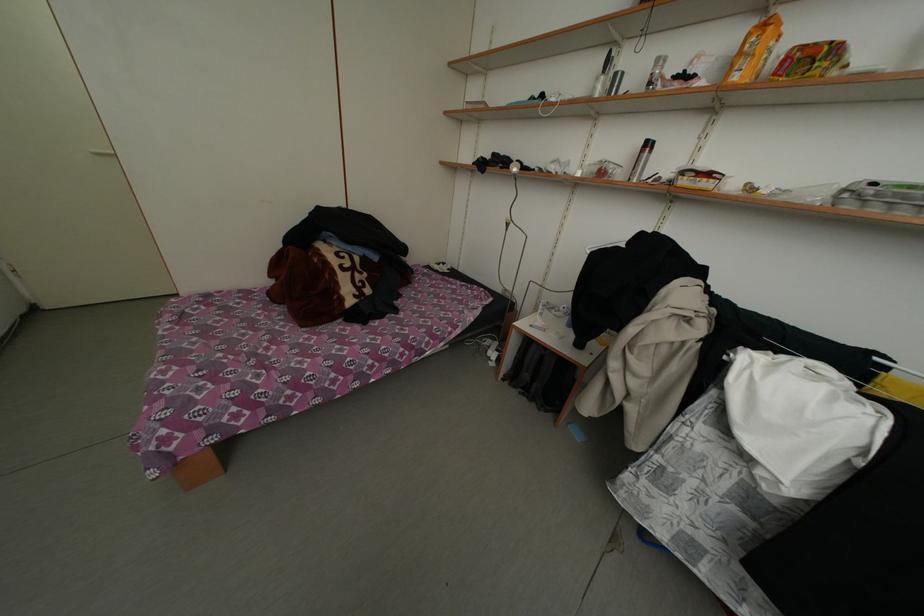
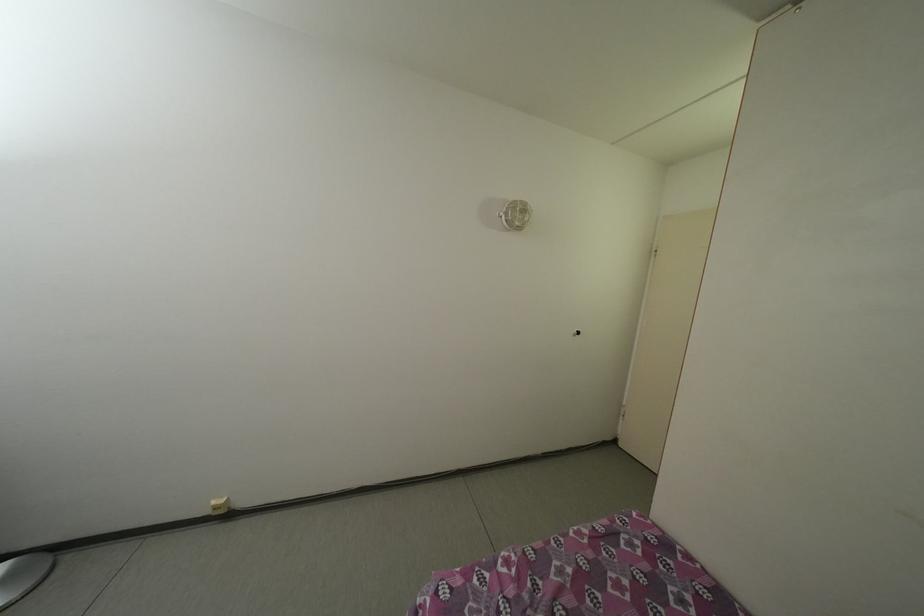
Question: The first image is from the beginning of the video and the second image is from the end. How did the camera likely rotate when shooting the video?

Choices:
 (A) Left
 (B) Right
 (C) Up
 (D) Down

Answer: (A)